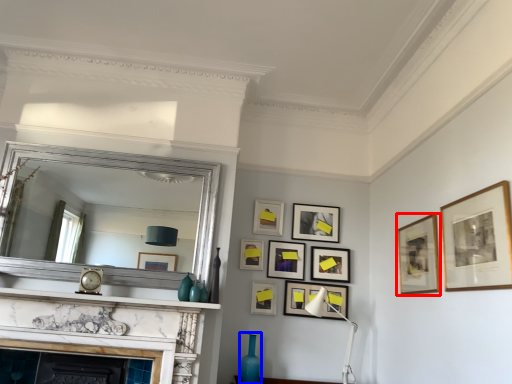
Question: Which of the following is the farthest to the observer, picture frame (highlighted by a red box) or vase (highlighted by a blue box)?

Choices:
 (A) picture frame
 (B) vase

Answer: (B)